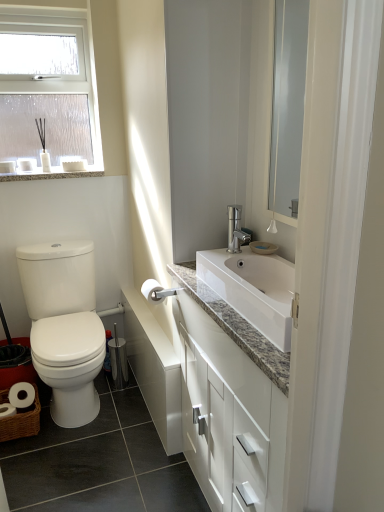
Question: Is granite countertop at upper left positioned with its back to white glossy toilet at left?

Choices:
 (A) no
 (B) yes

Answer: (A)

Question: From a real-world perspective, is granite countertop at upper left physically above white glossy toilet at left?

Choices:
 (A) yes
 (B) no

Answer: (A)

Question: Would you say granite countertop at upper left is a long distance from white glossy toilet at left?

Choices:
 (A) yes
 (B) no

Answer: (B)

Question: Considering the relative positions of granite countertop at upper left and white glossy toilet at left in the image provided, is granite countertop at upper left to the left of white glossy toilet at left from the viewer's perspective?

Choices:
 (A) no
 (B) yes

Answer: (B)

Question: Considering the relative sizes of granite countertop at upper left and white glossy toilet at left in the image provided, is granite countertop at upper left thinner than white glossy toilet at left?

Choices:
 (A) yes
 (B) no

Answer: (A)

Question: Can you confirm if granite countertop at upper left is positioned to the right of white glossy toilet at left?

Choices:
 (A) yes
 (B) no

Answer: (B)

Question: From a real-world perspective, is granite countertop at upper left positioned under frosted glass window at upper left based on gravity?

Choices:
 (A) yes
 (B) no

Answer: (A)

Question: Could you tell me if granite countertop at upper left is facing frosted glass window at upper left?

Choices:
 (A) yes
 (B) no

Answer: (B)

Question: Can you confirm if granite countertop at upper left is bigger than frosted glass window at upper left?

Choices:
 (A) yes
 (B) no

Answer: (B)

Question: Is granite countertop at upper left far away from frosted glass window at upper left?

Choices:
 (A) no
 (B) yes

Answer: (A)

Question: From the image's perspective, would you say granite countertop at upper left is shown under frosted glass window at upper left?

Choices:
 (A) no
 (B) yes

Answer: (B)

Question: Considering the relative positions of granite countertop at upper left and frosted glass window at upper left in the image provided, is granite countertop at upper left to the right of frosted glass window at upper left from the viewer's perspective?

Choices:
 (A) no
 (B) yes

Answer: (B)

Question: From the image's perspective, does frosted glass window at upper left appear higher than granite countertop at upper left?

Choices:
 (A) no
 (B) yes

Answer: (B)